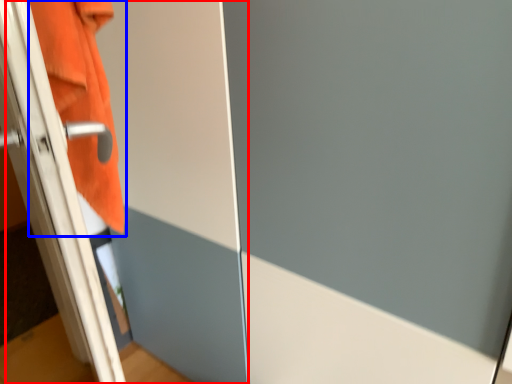
Question: Among these objects, which one is nearest to the camera, screen door (highlighted by a red box) or bath towel (highlighted by a blue box)?

Choices:
 (A) screen door
 (B) bath towel

Answer: (A)